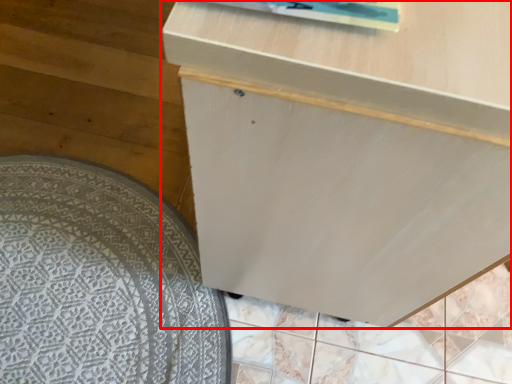
Question: From the image, what is the correct spatial relationship of furniture (annotated by the red box) in relation to mat?

Choices:
 (A) right
 (B) left

Answer: (A)